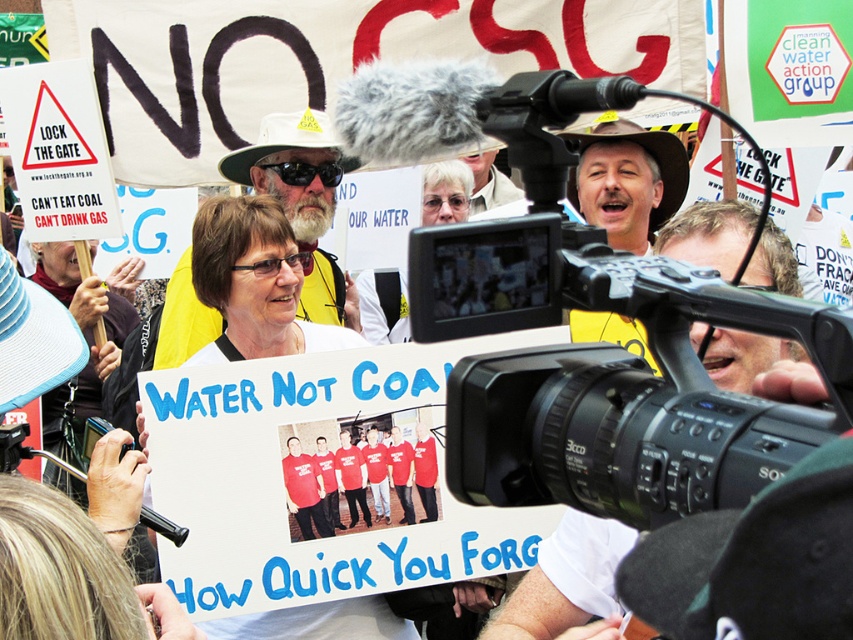
Question: Which point appears farthest from the camera in this image?

Choices:
 (A) (403, 304)
 (B) (219, 246)

Answer: (A)

Question: Which point is closer to the camera?

Choices:
 (A) (260, 308)
 (B) (390, 326)

Answer: (A)

Question: Can you confirm if white paper sign at center is positioned to the right of matte white sign at center?

Choices:
 (A) no
 (B) yes

Answer: (A)

Question: Is white paper sign at center above matte white sign at center?

Choices:
 (A) no
 (B) yes

Answer: (A)

Question: Does white paper sign at center have a larger size compared to matte white sign at center?

Choices:
 (A) no
 (B) yes

Answer: (B)